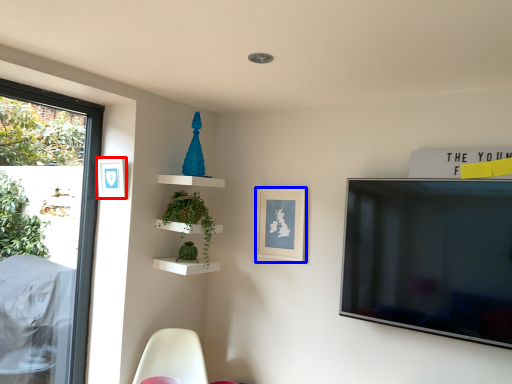
Question: Which object is closer to the camera taking this photo, picture frame (highlighted by a red box) or picture frame (highlighted by a blue box)?

Choices:
 (A) picture frame
 (B) picture frame

Answer: (A)